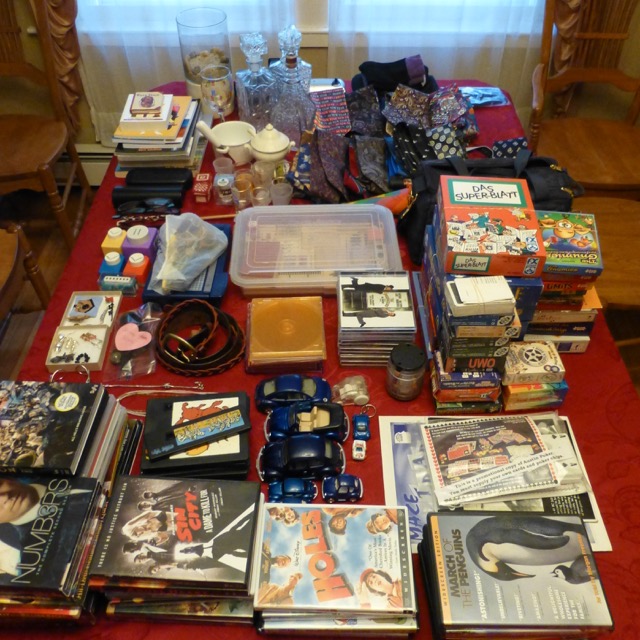
This screenshot has height=640, width=640. I want to click on table cover, so click(x=592, y=404).